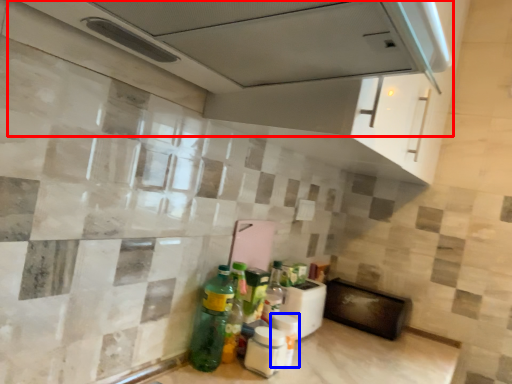
Question: Among these objects, which one is farthest to the camera, exhaust hood (highlighted by a red box) or bottle (highlighted by a blue box)?

Choices:
 (A) exhaust hood
 (B) bottle

Answer: (B)